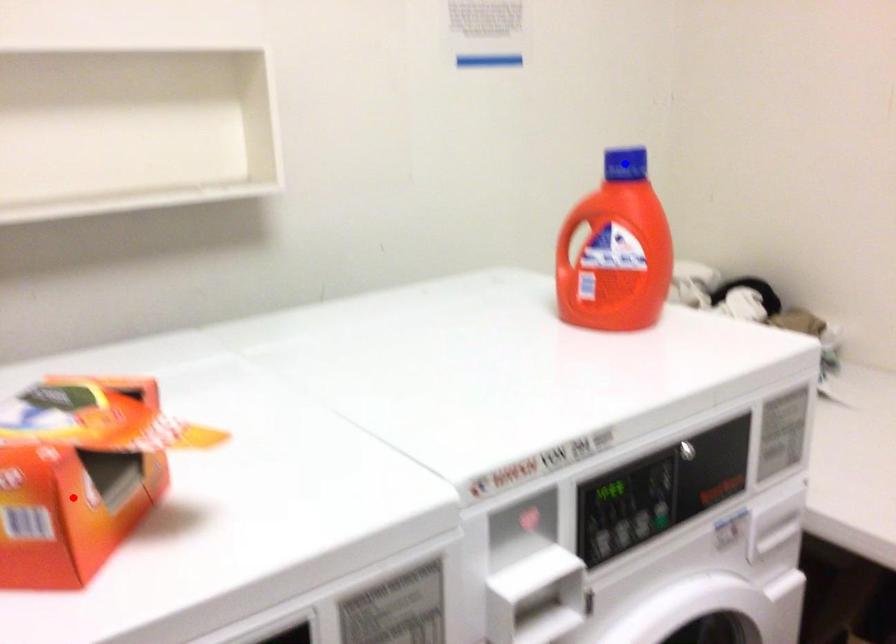
Question: Two points are marked on the image. Which point is closer to the camera?

Choices:
 (A) Blue point is closer.
 (B) Red point is closer.

Answer: (B)